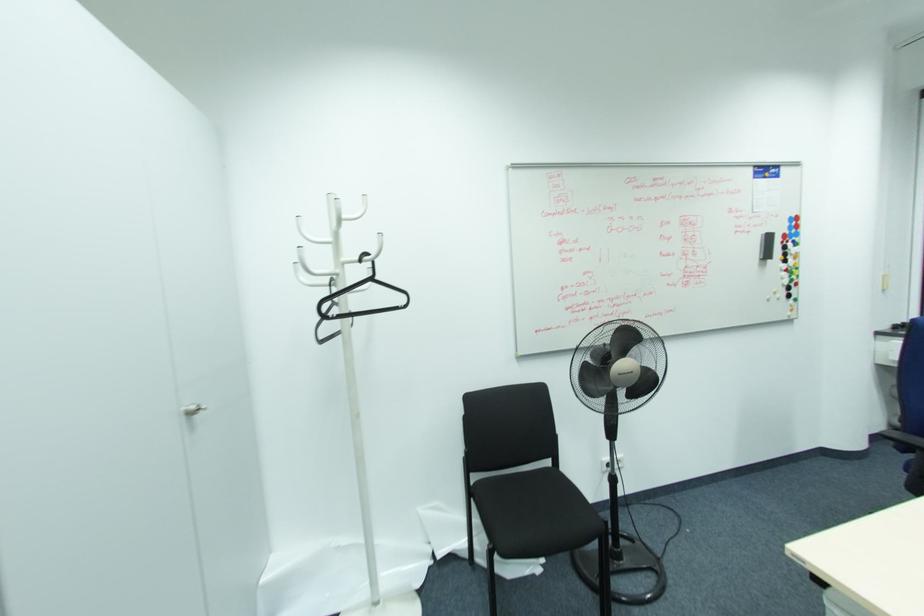
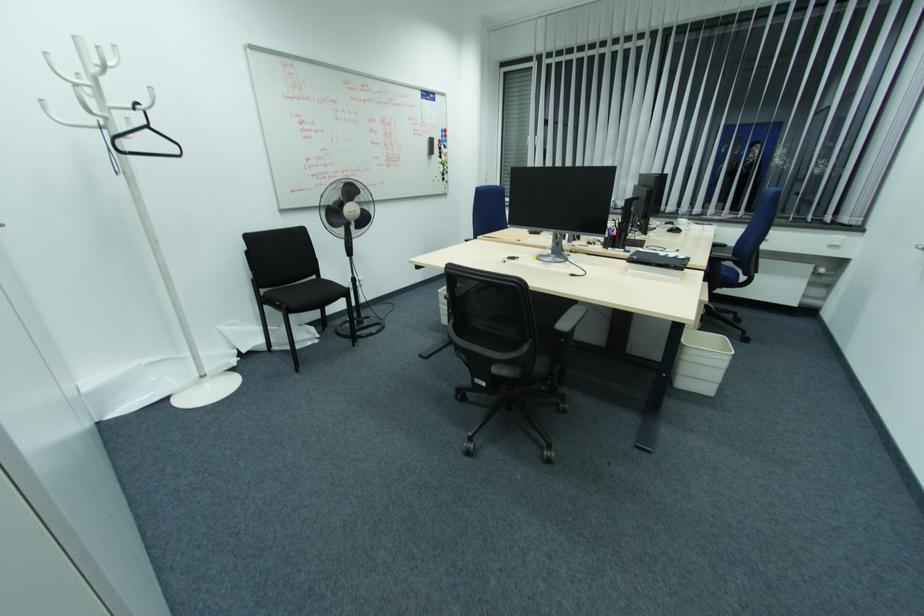
In the second image, find the point that corresponds to (x=366, y=254) in the first image.

(139, 105)